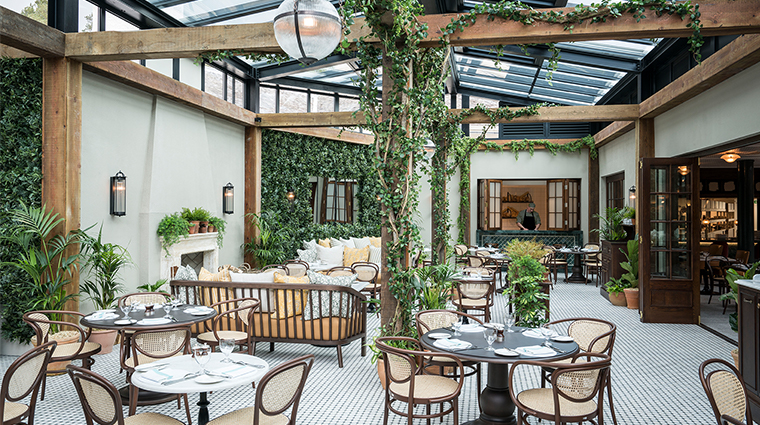
In order to click on floor in this screenshot , I will do `click(334, 407)`.